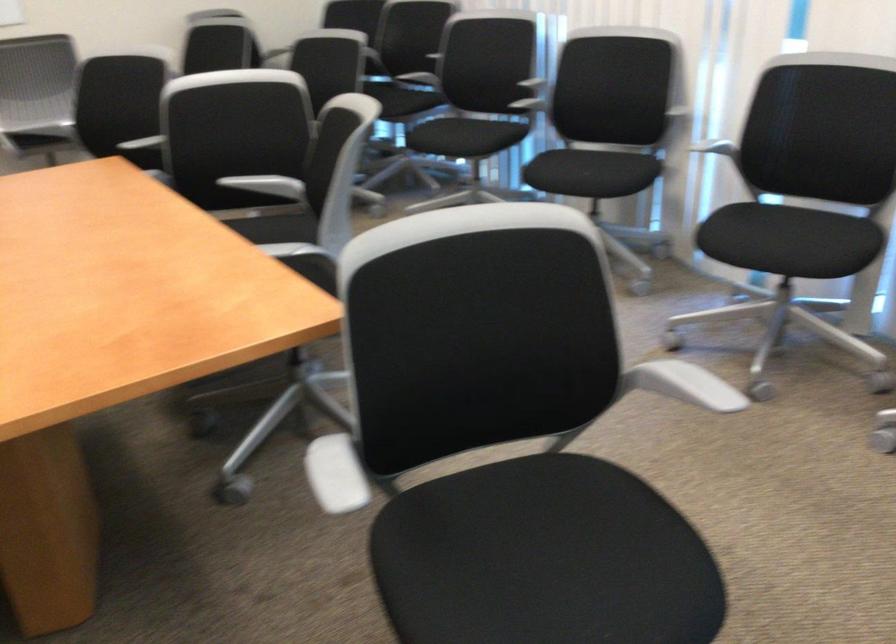
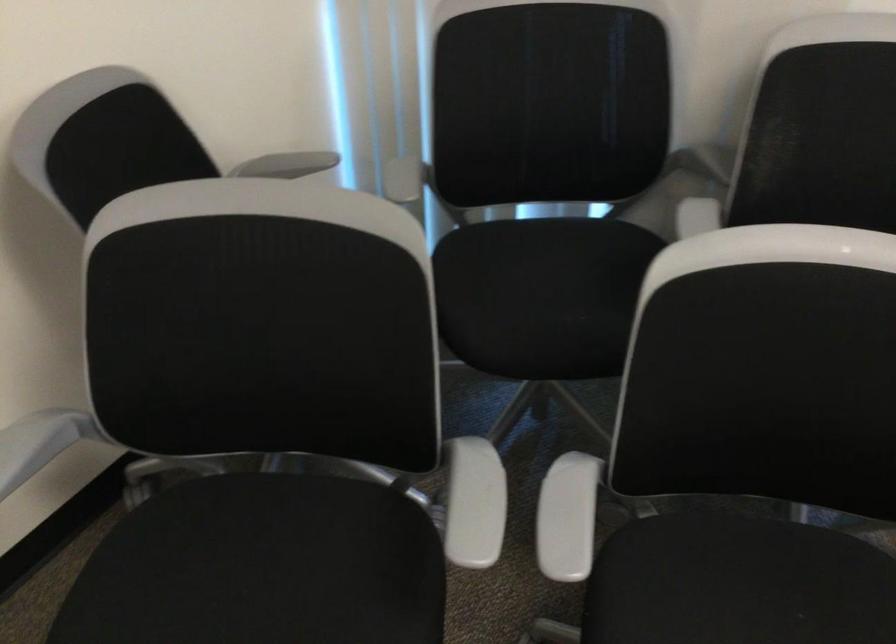
The images are taken continuously from a first-person perspective. In which direction are you moving?

The movement direction of the cameraman is left, forward.